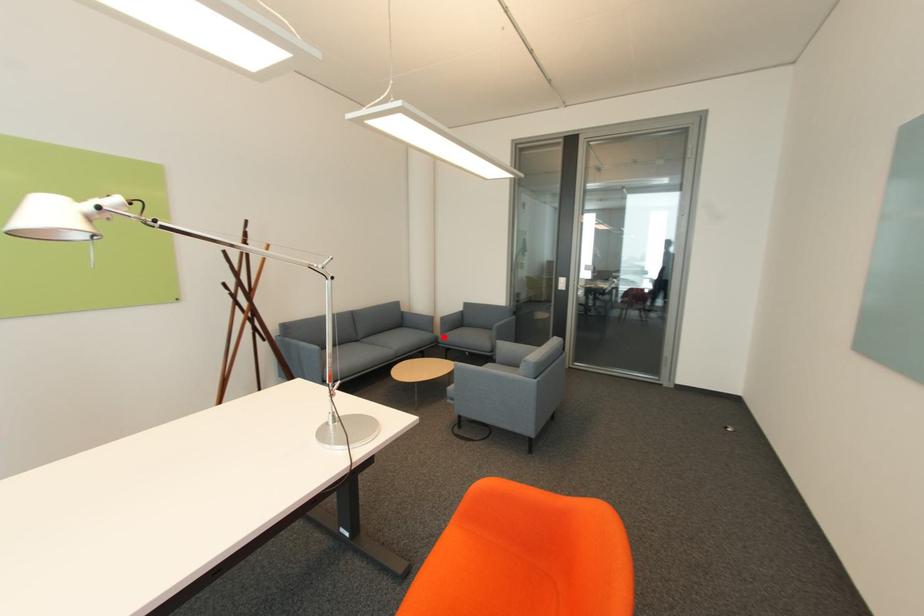
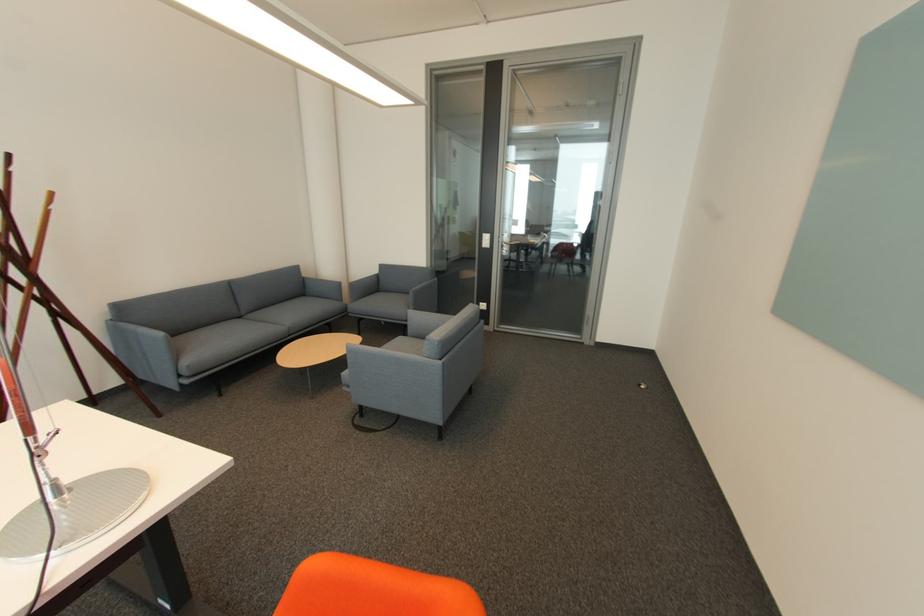
Find the pixel in the second image that matches the highlighted location in the first image.

(353, 305)